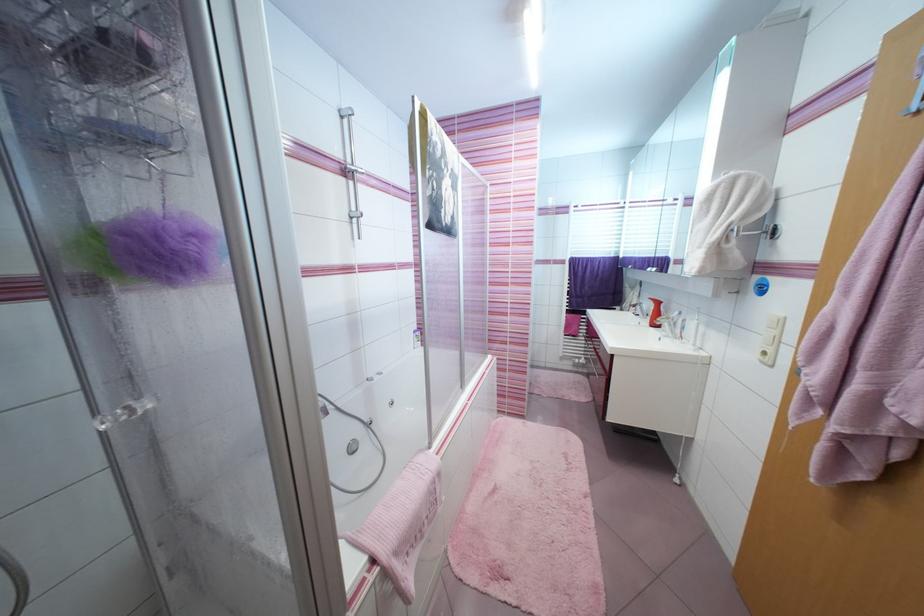
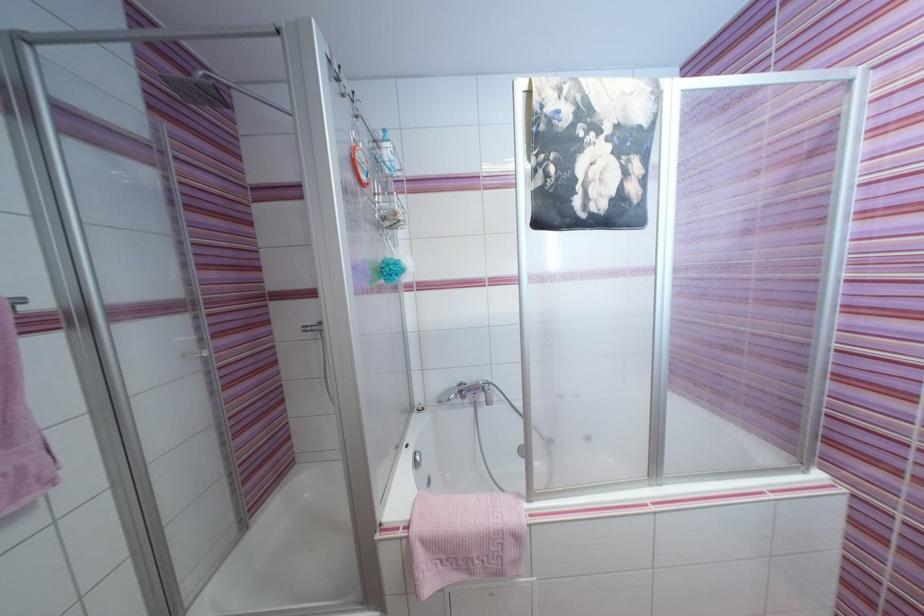
The point at [444,476] is marked in the first image. Where is the corresponding point in the second image?

(521, 539)